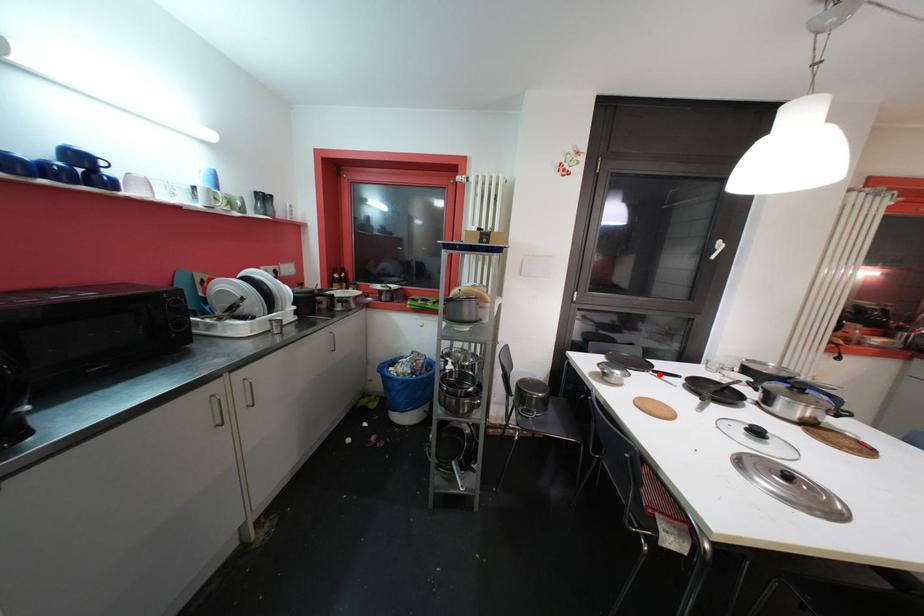
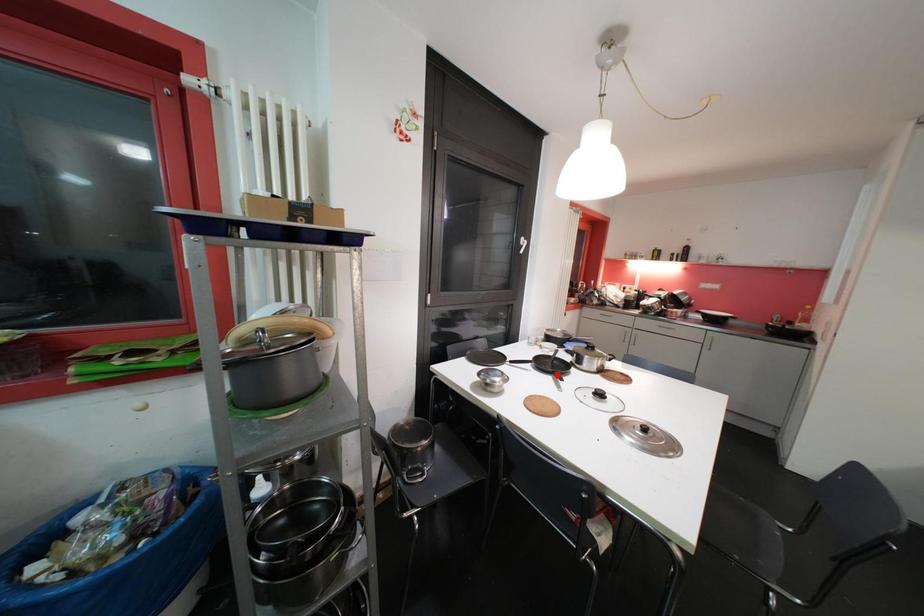
I am providing you with two images of the same scene from different viewpoints. A red point is marked on the first image and another point is marked on the second image. Is the marked point in image1 the same physical position as the marked point in image2?

No